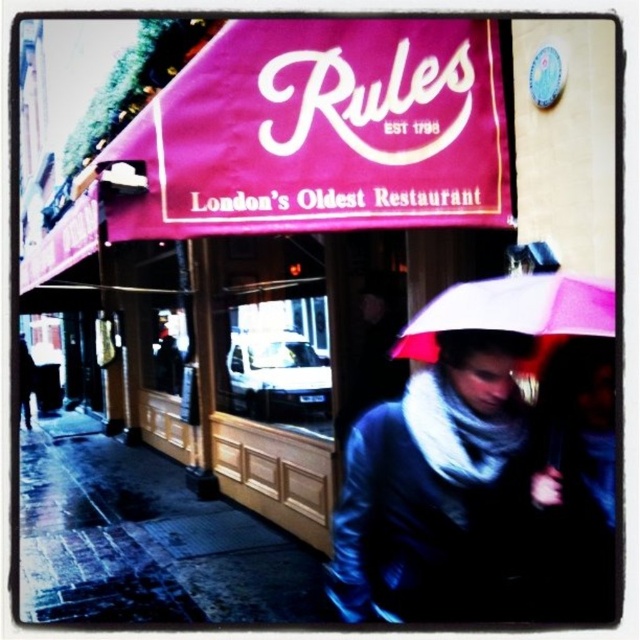
You are a delivery person standing on the wet street in front of the restaurant. You see a matte black jacket at center and a pink matte umbrella at lower center. Which object is taller?

The matte black jacket at center is taller than the pink matte umbrella at lower center.

You are a delivery person approaching the restaurant and see the pink matte umbrella at lower center and the wet asphalt at lower left. Which object is closer to you as you walk towards the restaurant entrance?

The wet asphalt at lower left is closer to you because the pink matte umbrella at lower center is behind it.